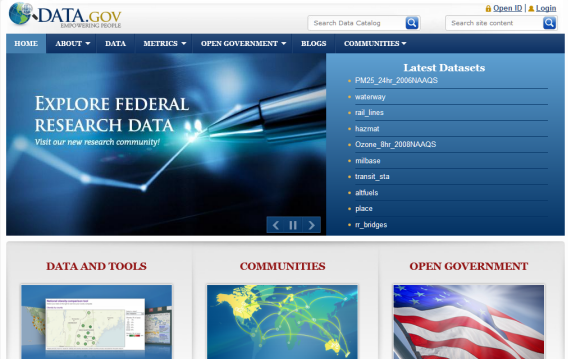
Where is `panel`? The width and height of the screenshot is (568, 359). panel is located at coordinates 125,310, 316,309, 486,314.